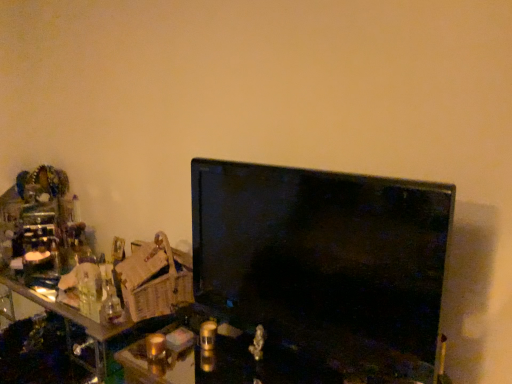
Measure the distance between point (332,230) and camera.

The depth of point (332,230) is 1.07 meters.

This screenshot has height=384, width=512. What are the coordinates of `black glossy tv at center` in the screenshot? It's located at (325, 262).

This screenshot has width=512, height=384. What do you see at coordinates (325, 262) in the screenshot? I see `black glossy tv at center` at bounding box center [325, 262].

In order to face black glossy tv at center, should I rotate leftwards or rightwards?

Turn right by 5.261 degrees to look at black glossy tv at center.

What do you see at coordinates (249, 360) in the screenshot?
I see `matte black monitor at center` at bounding box center [249, 360].

Locate an element on the screen. The width and height of the screenshot is (512, 384). matte black monitor at center is located at coordinates (249, 360).

Locate an element on the screen. The height and width of the screenshot is (384, 512). black glossy tv at center is located at coordinates (325, 262).

Between black glossy tv at center and matte black monitor at center, which one appears on the right side from the viewer's perspective?

black glossy tv at center.

In the image, is black glossy tv at center positioned in front of or behind matte black monitor at center?

In the image, black glossy tv at center appears behind matte black monitor at center.

Which is farther from the camera, (316, 176) or (208, 368)?

Positioned behind is point (208, 368).

From the image's perspective, which is below, black glossy tv at center or matte black monitor at center?

From the image's view, matte black monitor at center is below.

From a real-world perspective, relative to matte black monitor at center, is black glossy tv at center vertically above or below?

In terms of real-world spatial position, black glossy tv at center is above matte black monitor at center.

Can you confirm if black glossy tv at center is wider than matte black monitor at center?

No, black glossy tv at center is not wider than matte black monitor at center.

Does black glossy tv at center have a greater height compared to matte black monitor at center?

Correct, black glossy tv at center is much taller as matte black monitor at center.

Between black glossy tv at center and matte black monitor at center, which one has smaller size?

With smaller size is black glossy tv at center.

Which is correct: black glossy tv at center is inside matte black monitor at center, or outside of it?

black glossy tv at center is not inside matte black monitor at center, it's outside.

Is black glossy tv at center placed right next to matte black monitor at center?

No, black glossy tv at center is not next to matte black monitor at center.

Is black glossy tv at center oriented towards matte black monitor at center?

No, black glossy tv at center does not turn towards matte black monitor at center.

Find the location of a particular element. The image size is (512, 384). television on the right of matte black monitor at center is located at coordinates (325, 262).

Which object is positioned more to the left, matte black monitor at center or black glossy tv at center?

Positioned to the left is matte black monitor at center.

Does matte black monitor at center lie in front of black glossy tv at center?

Yes.

Is point (265, 374) positioned behind point (406, 288)?

Yes, point (265, 374) is behind point (406, 288).

From the image's perspective, is matte black monitor at center above or below black glossy tv at center?

matte black monitor at center is situated lower than black glossy tv at center in the image.

From a real-world perspective, does matte black monitor at center sit lower than black glossy tv at center?

Yes, from a real-world perspective, matte black monitor at center is under black glossy tv at center.

Can you confirm if matte black monitor at center is thinner than black glossy tv at center?

No, matte black monitor at center is not thinner than black glossy tv at center.

Considering the relative sizes of matte black monitor at center and black glossy tv at center in the image provided, is matte black monitor at center taller than black glossy tv at center?

No.

Considering the sizes of objects matte black monitor at center and black glossy tv at center in the image provided, who is bigger, matte black monitor at center or black glossy tv at center?

matte black monitor at center.

Is black glossy tv at center located within matte black monitor at center?

No, black glossy tv at center is not surrounded by matte black monitor at center.

Is the surface of matte black monitor at center in direct contact with black glossy tv at center?

No.

Is matte black monitor at center facing towards black glossy tv at center?

No, matte black monitor at center does not turn towards black glossy tv at center.

How distant is matte black monitor at center from black glossy tv at center?

matte black monitor at center is 8.30 inches from black glossy tv at center.

The image size is (512, 384). In order to click on computer that is under the black glossy tv at center (from a real-world perspective) in this screenshot , I will do `click(249, 360)`.

Identify the location of television that is above the matte black monitor at center (from a real-world perspective). (325, 262).

Image resolution: width=512 pixels, height=384 pixels. In order to click on television behind the matte black monitor at center in this screenshot , I will do `click(325, 262)`.